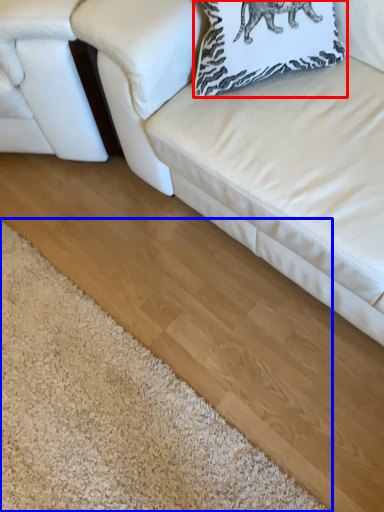
Question: Which object is further to the camera taking this photo, pillow (highlighted by a red box) or mat (highlighted by a blue box)?

Choices:
 (A) pillow
 (B) mat

Answer: (A)